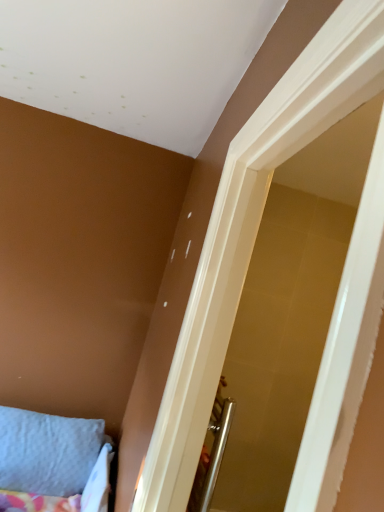
Question: Should I look upward or downward to see light blue fabric pillow at lower left?

Choices:
 (A) up
 (B) down

Answer: (B)